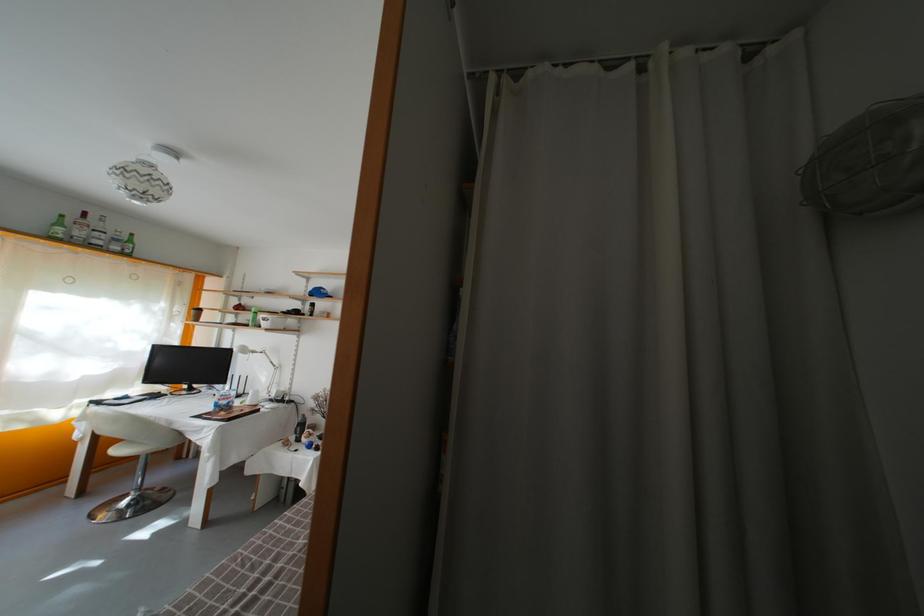
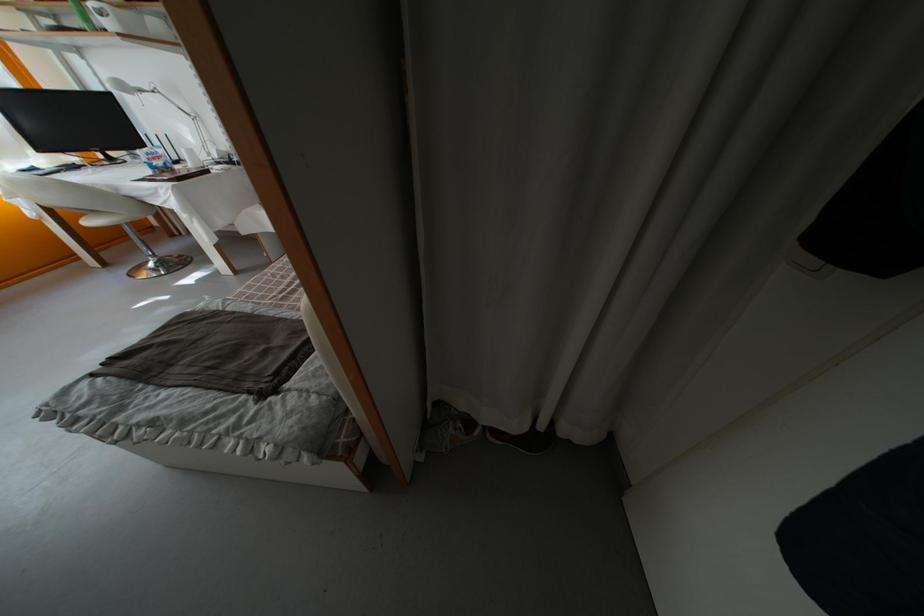
The point at (123, 448) is marked in the first image. Where is the corresponding point in the second image?

(84, 221)